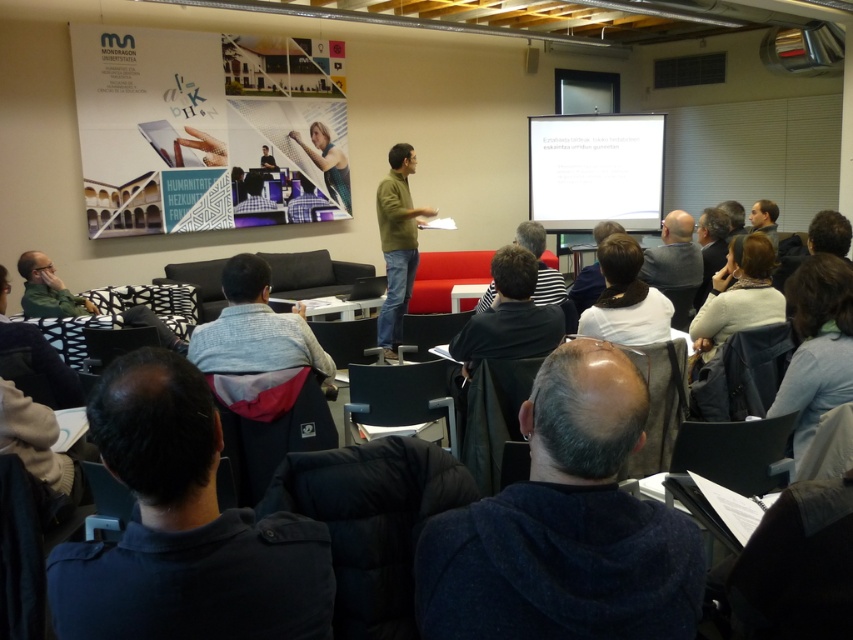
Question: Is dark blue hoodie at lower center wider than black striped shirt at center?

Choices:
 (A) no
 (B) yes

Answer: (A)

Question: Which object is farther from the camera taking this photo?

Choices:
 (A) matte white poster at upper left
 (B) striped shirt at center
 (C) green sweater at center
 (D) light brown wooden chair at center

Answer: (D)

Question: Which point is farther to the camera?

Choices:
 (A) (767, 208)
 (B) (36, 330)
 (C) (717, 262)

Answer: (A)

Question: Does dark blue fabric at lower left have a larger size compared to black striped shirt at center?

Choices:
 (A) yes
 (B) no

Answer: (B)

Question: Is white matte projection screen at upper center wider than green matte jacket at lower left?

Choices:
 (A) no
 (B) yes

Answer: (B)

Question: Which point is closer to the camera?

Choices:
 (A) (125, 314)
 (B) (769, 232)
 (C) (320, 124)
 (D) (527, 144)

Answer: (A)